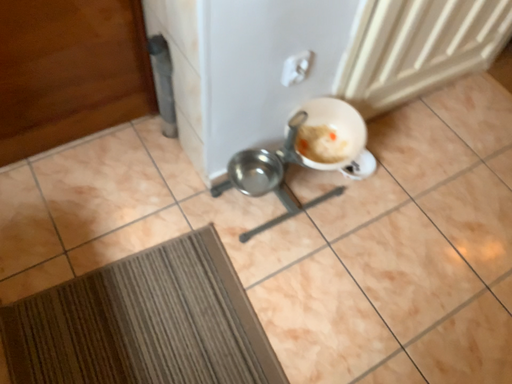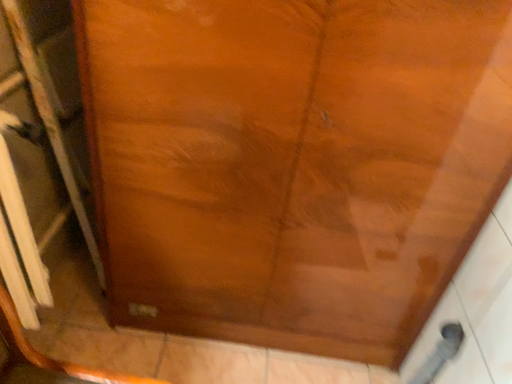
Question: How did the camera likely rotate when shooting the video?

Choices:
 (A) rotated right
 (B) rotated left

Answer: (B)